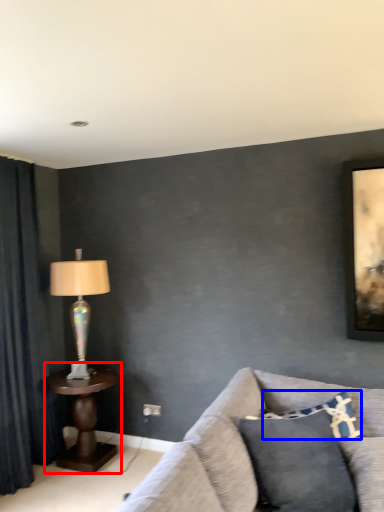
Question: Which of the following is the farthest to the observer, table (highlighted by a red box) or pillow (highlighted by a blue box)?

Choices:
 (A) table
 (B) pillow

Answer: (A)